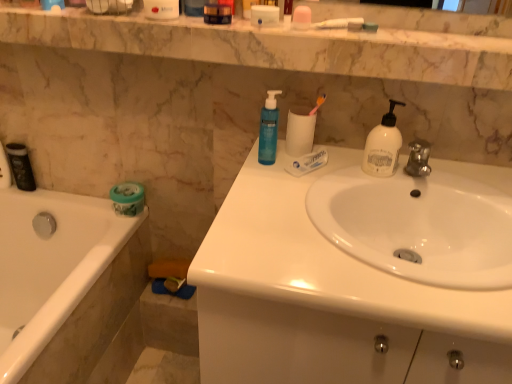
Question: In which direction should I rotate to look at white matte toilet paper at center, arranged as the first toilet paper when viewed from the top?

Choices:
 (A) left
 (B) right

Answer: (B)

Question: From the image's perspective, is white matte toilet paper at center, which is the 2th toilet paper in back-to-front order, below white glossy sink at center, acting as the 1th sink starting from the top?

Choices:
 (A) no
 (B) yes

Answer: (A)

Question: Can you confirm if white matte toilet paper at center, which is the 2th toilet paper in back-to-front order, is bigger than white glossy sink at center, the second sink in the bottom-to-top sequence?

Choices:
 (A) no
 (B) yes

Answer: (A)

Question: Is white matte toilet paper at center, which is the second toilet paper in left-to-right order, taller than white glossy sink at center, acting as the 1th sink starting from the top?

Choices:
 (A) yes
 (B) no

Answer: (B)

Question: Considering the relative sizes of white matte toilet paper at center, which appears as the 1th toilet paper when viewed from the front, and white glossy sink at center, the second sink in the bottom-to-top sequence, in the image provided, is white matte toilet paper at center, which appears as the 1th toilet paper when viewed from the front, wider than white glossy sink at center, the second sink in the bottom-to-top sequence,?

Choices:
 (A) yes
 (B) no

Answer: (B)

Question: Is white matte toilet paper at center, which is the first toilet paper in right-to-left order, facing towards white glossy sink at center, acting as the 1th sink starting from the top?

Choices:
 (A) no
 (B) yes

Answer: (A)

Question: Is the position of white matte toilet paper at center, which appears as the 1th toilet paper when viewed from the front, more distant than that of white glossy sink at center, acting as the 1th sink starting from the top?

Choices:
 (A) no
 (B) yes

Answer: (B)

Question: Does white glossy sink at center, the second sink in the bottom-to-top sequence, have a greater height compared to black matte canister at left?

Choices:
 (A) no
 (B) yes

Answer: (A)

Question: Is white glossy sink at center, acting as the 1th sink starting from the top, to the right of black matte canister at left from the viewer's perspective?

Choices:
 (A) no
 (B) yes

Answer: (B)

Question: Considering the relative sizes of white glossy sink at center, acting as the 1th sink starting from the top, and black matte canister at left in the image provided, is white glossy sink at center, acting as the 1th sink starting from the top, smaller than black matte canister at left?

Choices:
 (A) yes
 (B) no

Answer: (B)

Question: Does white glossy sink at center, acting as the 1th sink starting from the top, have a lesser width compared to black matte canister at left?

Choices:
 (A) yes
 (B) no

Answer: (B)

Question: Is white glossy sink at center, acting as the 1th sink starting from the top, touching black matte canister at left?

Choices:
 (A) no
 (B) yes

Answer: (A)

Question: Is white glossy sink at center, acting as the 1th sink starting from the top, facing towards black matte canister at left?

Choices:
 (A) yes
 (B) no

Answer: (B)

Question: Does marble at upper center have a lesser height compared to white glossy bathtub at left?

Choices:
 (A) no
 (B) yes

Answer: (B)